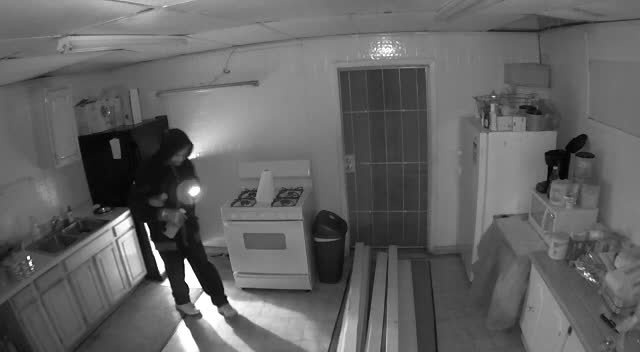
Where is `microwave`? The image size is (640, 352). microwave is located at coordinates (545, 222).